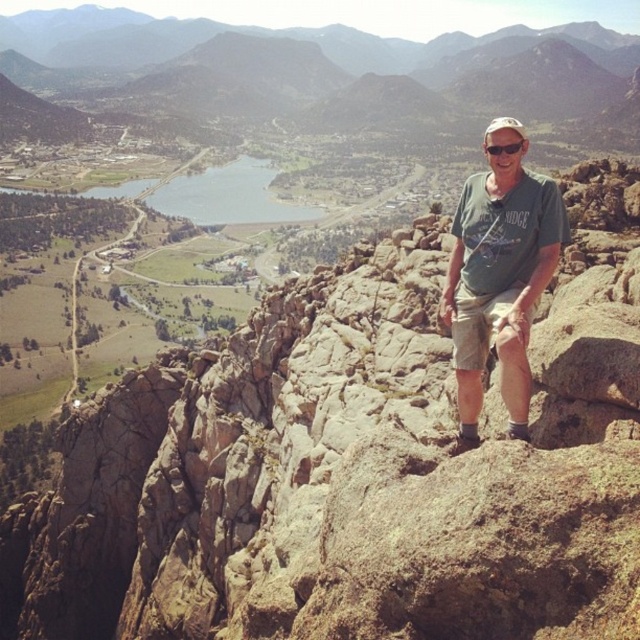
You are a hiker trying to locate your gear. You see the brown rocky mountain at center and the black plastic goggles at upper center. Which object is located to the right of the other?

The black plastic goggles at upper center are located to the right of the brown rocky mountain at center.